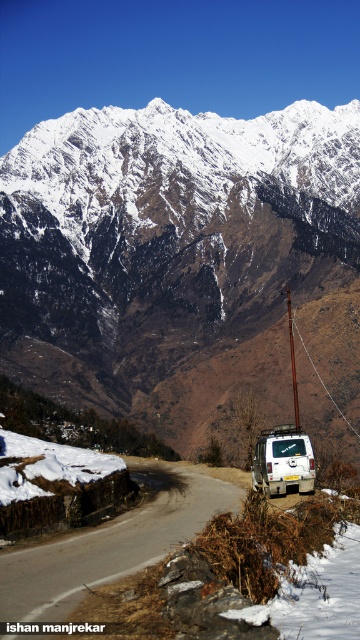
Question: Among these objects, which one is nearest to the camera?

Choices:
 (A) brown wooden pole at center
 (B) snowy granite mountain range at upper center

Answer: (A)

Question: Which object is closer to the camera taking this photo?

Choices:
 (A) snowy granite mountain range at upper center
 (B) white gravel road at center
 (C) brown wooden pole at center

Answer: (B)

Question: Does white gravel road at center appear over brown wooden pole at center?

Choices:
 (A) yes
 (B) no

Answer: (B)

Question: Which point appears closest to the camera in this image?

Choices:
 (A) (x=90, y=237)
 (B) (x=289, y=326)
 (C) (x=55, y=618)
 (D) (x=273, y=488)

Answer: (C)

Question: Is white gravel road at center further to the viewer compared to brown wooden pole at center?

Choices:
 (A) yes
 (B) no

Answer: (B)

Question: Can you confirm if white matte van at lower right is positioned to the right of brown wooden pole at center?

Choices:
 (A) no
 (B) yes

Answer: (A)